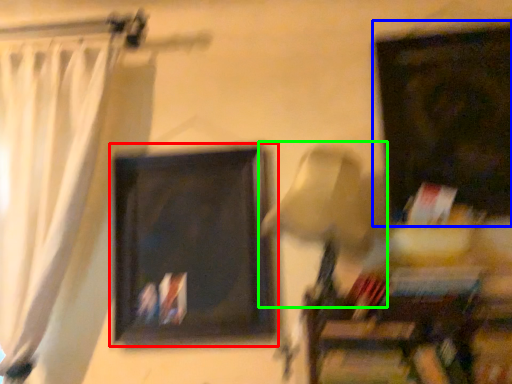
Question: Considering the real-world distances, which object is farthest from picture frame (highlighted by a red box)? picture frame (highlighted by a blue box) or table lamp (highlighted by a green box)?

Choices:
 (A) picture frame
 (B) table lamp

Answer: (A)